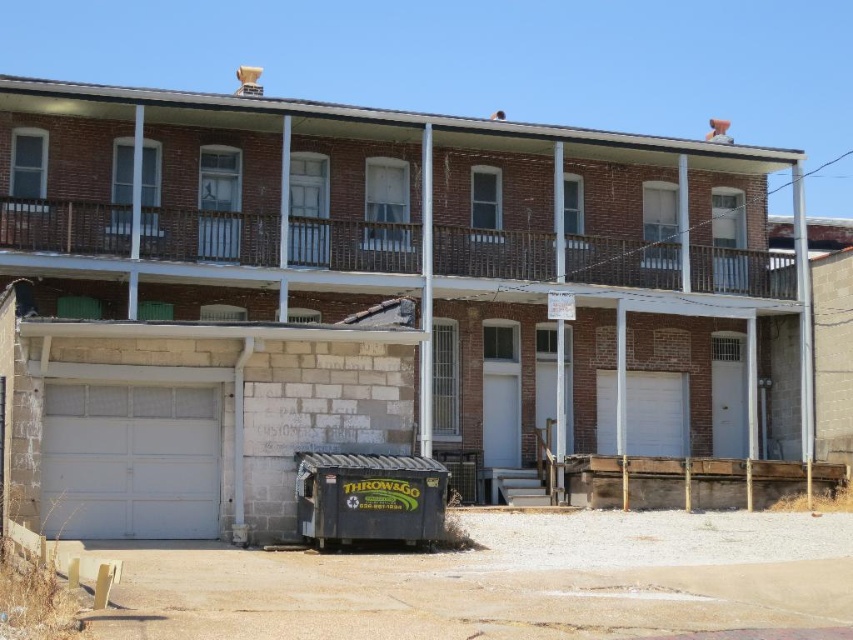
You are a delivery person trying to park your van in front of the building. The van requires a garage door that is taller than 2 meters. Based on the image, which garage door between the white smooth garage door at lower left and the white matte garage door at center should you choose?

The white smooth garage door at lower left is much taller than the white matte garage door at center, so the delivery person should choose the white smooth garage door at lower left as it meets the height requirement of over 2 meters.

You are standing in front of a two story brick building. You see a point at coordinate (357, 292). What object is located at that point?

The white matte garage door at lower left is represented by point (357, 292).